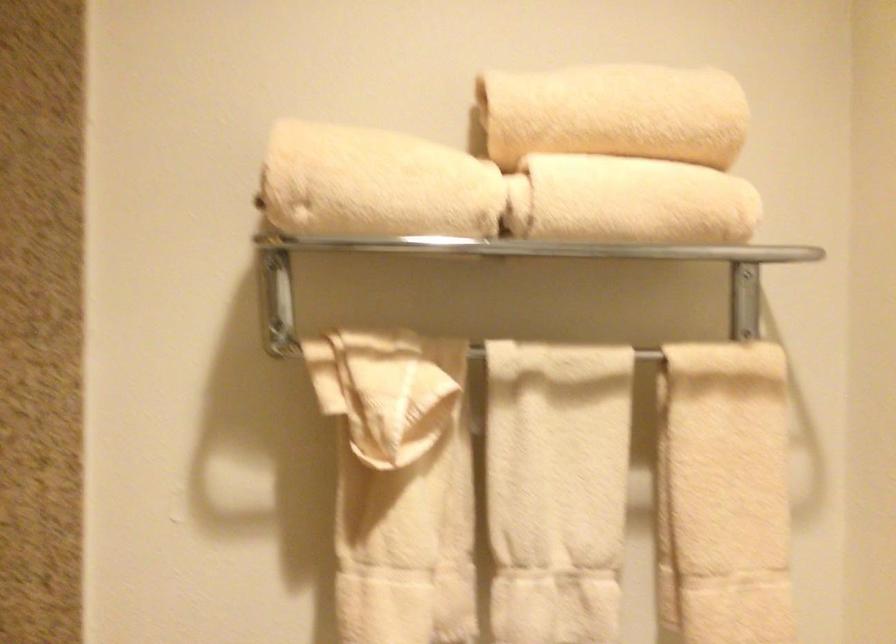
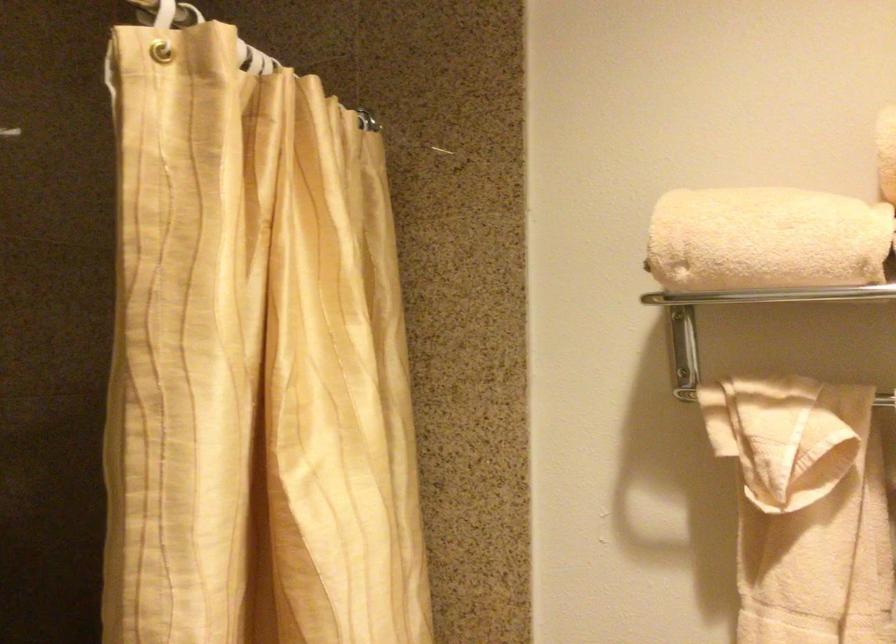
The point at (390,184) is marked in the first image. Where is the corresponding point in the second image?

(765, 240)